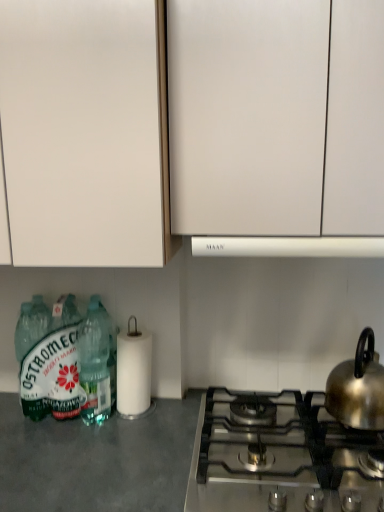
This screenshot has width=384, height=512. Identify the location of translucent plastic bottles at lower left, arranged as the 1th bottle when viewed from the right. (95, 364).

What do you see at coordinates (95, 364) in the screenshot? This screenshot has width=384, height=512. I see `translucent plastic bottles at lower left, arranged as the 1th bottle when viewed from the right` at bounding box center [95, 364].

Where is `green matte bottle at lower left, the first bottle viewed from the left`? This screenshot has height=512, width=384. green matte bottle at lower left, the first bottle viewed from the left is located at coordinates [x=49, y=358].

The image size is (384, 512). What do you see at coordinates (133, 371) in the screenshot?
I see `white matte paper towel at lower center` at bounding box center [133, 371].

This screenshot has height=512, width=384. Identify the location of white matte vent at center. (287, 247).

In order to face white matte vent at center, should I rotate leftwards or rightwards?

You should look right and rotate roughly 13.896 degrees.

Describe the element at coordinates (358, 388) in the screenshot. Image resolution: width=384 pixels, height=512 pixels. I see `shiny metallic kettle at right` at that location.

Locate an element on the screen. The height and width of the screenshot is (512, 384). white matte cabinet at upper center, the 2th cabinetry in the left-to-right sequence is located at coordinates (188, 124).

Between white matte cabinet at upper left, the second cabinetry from the right, and translucent plastic bottles at lower left, placed as the second bottle when sorted from left to right, which one has larger size?

white matte cabinet at upper left, the second cabinetry from the right, is bigger.

Considering the positions of objects white matte cabinet at upper left, the second cabinetry from the right, and translucent plastic bottles at lower left, arranged as the 1th bottle when viewed from the right, in the image provided, who is in front, white matte cabinet at upper left, the second cabinetry from the right, or translucent plastic bottles at lower left, arranged as the 1th bottle when viewed from the right,?

white matte cabinet at upper left, the second cabinetry from the right, is in front.

From the image's perspective, is white matte cabinet at upper left, placed as the 1th cabinetry when sorted from left to right, under translucent plastic bottles at lower left, placed as the second bottle when sorted from left to right?

Actually, white matte cabinet at upper left, placed as the 1th cabinetry when sorted from left to right, appears above translucent plastic bottles at lower left, placed as the second bottle when sorted from left to right, in the image.

Considering the sizes of objects white matte cabinet at upper left, placed as the 1th cabinetry when sorted from left to right, and translucent plastic bottles at lower left, arranged as the 1th bottle when viewed from the right, in the image provided, who is wider, white matte cabinet at upper left, placed as the 1th cabinetry when sorted from left to right, or translucent plastic bottles at lower left, arranged as the 1th bottle when viewed from the right,?

white matte cabinet at upper left, placed as the 1th cabinetry when sorted from left to right.

Who is smaller, white matte cabinet at upper center, the 2th cabinetry in the left-to-right sequence, or gray matte countertop at lower left?

With smaller size is white matte cabinet at upper center, the 2th cabinetry in the left-to-right sequence.

How different are the orientations of white matte cabinet at upper center, which ranks as the 1th cabinetry in right-to-left order, and gray matte countertop at lower left in degrees?

0.584 degrees.

There is a gray matte countertop at lower left. Where is `the 2nd cabinetry above it (from a real-world perspective)`? Image resolution: width=384 pixels, height=512 pixels. the 2nd cabinetry above it (from a real-world perspective) is located at coordinates (188, 124).

Does white matte cabinet at upper center, the 2th cabinetry in the left-to-right sequence, contain gray matte countertop at lower left?

No, gray matte countertop at lower left is located outside of white matte cabinet at upper center, the 2th cabinetry in the left-to-right sequence.

The image size is (384, 512). I want to click on the 1st bottle behind the gray matte countertop at lower left, so point(95,364).

Would you say gray matte countertop at lower left is inside or outside translucent plastic bottles at lower left, placed as the second bottle when sorted from left to right?

gray matte countertop at lower left is located beyond the bounds of translucent plastic bottles at lower left, placed as the second bottle when sorted from left to right.

Consider the image. How different are the orientations of gray matte countertop at lower left and translucent plastic bottles at lower left, arranged as the 1th bottle when viewed from the right, in degrees?

0.979 degrees.

Considering the sizes of gray matte countertop at lower left and translucent plastic bottles at lower left, placed as the second bottle when sorted from left to right, in the image, is gray matte countertop at lower left bigger or smaller than translucent plastic bottles at lower left, placed as the second bottle when sorted from left to right,?

Considering their sizes, gray matte countertop at lower left takes up more space than translucent plastic bottles at lower left, placed as the second bottle when sorted from left to right.

From a real-world perspective, which is physically above, translucent plastic bottles at lower left, arranged as the 1th bottle when viewed from the right, or white matte vent at center?

white matte vent at center.

Considering the sizes of objects translucent plastic bottles at lower left, placed as the second bottle when sorted from left to right, and white matte vent at center in the image provided, who is smaller, translucent plastic bottles at lower left, placed as the second bottle when sorted from left to right, or white matte vent at center?

translucent plastic bottles at lower left, placed as the second bottle when sorted from left to right, is smaller.

Which point is more distant from viewer, [88,367] or [253,244]?

The point [88,367] is farther.

Which is correct: satin silver gas stove at lower right is inside white matte cabinet at upper center, the 2th cabinetry in the left-to-right sequence, or outside of it?

satin silver gas stove at lower right lies outside white matte cabinet at upper center, the 2th cabinetry in the left-to-right sequence.

Is satin silver gas stove at lower right aimed at white matte cabinet at upper center, which ranks as the 1th cabinetry in right-to-left order?

No, satin silver gas stove at lower right is not oriented towards white matte cabinet at upper center, which ranks as the 1th cabinetry in right-to-left order.

From the image's perspective, which is above, shiny metallic kettle at right or gray matte countertop at lower left?

shiny metallic kettle at right.

Is shiny metallic kettle at right looking in the opposite direction of gray matte countertop at lower left?

No, shiny metallic kettle at right is not facing away from gray matte countertop at lower left.

Is shiny metallic kettle at right placed right next to gray matte countertop at lower left?

They are not placed beside each other.

Is shiny metallic kettle at right behind gray matte countertop at lower left?

Yes, shiny metallic kettle at right is further from the viewer.

Considering the relative sizes of white matte cabinet at upper center, the 2th cabinetry in the left-to-right sequence, and shiny metallic kettle at right in the image provided, is white matte cabinet at upper center, the 2th cabinetry in the left-to-right sequence, bigger than shiny metallic kettle at right?

Indeed, white matte cabinet at upper center, the 2th cabinetry in the left-to-right sequence, has a larger size compared to shiny metallic kettle at right.

In the scene shown: From a real-world perspective, is white matte cabinet at upper center, which ranks as the 1th cabinetry in right-to-left order, over shiny metallic kettle at right?

Correct, in the physical world, white matte cabinet at upper center, which ranks as the 1th cabinetry in right-to-left order, is higher than shiny metallic kettle at right.

Could you measure the distance between white matte cabinet at upper center, the 2th cabinetry in the left-to-right sequence, and shiny metallic kettle at right?

white matte cabinet at upper center, the 2th cabinetry in the left-to-right sequence, and shiny metallic kettle at right are 25.70 inches apart from each other.

I want to click on bottle that is the 2nd one below the white matte cabinet at upper left, the second cabinetry from the right (from a real-world perspective), so click(x=95, y=364).

The height and width of the screenshot is (512, 384). Identify the location of counter top that appears below the white matte cabinet at upper center, the 2th cabinetry in the left-to-right sequence (from the image's perspective). (97, 460).

Based on their spatial positions, is white matte vent at center or white matte cabinet at upper center, which ranks as the 1th cabinetry in right-to-left order, closer to white matte paper towel at lower center?

white matte vent at center lies closer to white matte paper towel at lower center than the other object.

Estimate the real-world distances between objects in this image. Which object is closer to gray matte countertop at lower left, white matte paper towel at lower center or green matte bottle at lower left, which is the 2th bottle from right to left?

The object closer to gray matte countertop at lower left is green matte bottle at lower left, which is the 2th bottle from right to left.

Considering their positions, is satin silver gas stove at lower right positioned closer to white matte cabinet at upper center, which ranks as the 1th cabinetry in right-to-left order, than white matte paper towel at lower center?

white matte paper towel at lower center is closer to white matte cabinet at upper center, which ranks as the 1th cabinetry in right-to-left order.

Based on their spatial positions, is translucent plastic bottles at lower left, arranged as the 1th bottle when viewed from the right, or shiny metallic kettle at right further from green matte bottle at lower left, which is the 2th bottle from right to left?

Based on the image, shiny metallic kettle at right appears to be further to green matte bottle at lower left, which is the 2th bottle from right to left.

When comparing their distances from white matte vent at center, does white matte cabinet at upper left, the second cabinetry from the right, or gray matte countertop at lower left seem further?

gray matte countertop at lower left.

Looking at the image, which one is located further to white matte cabinet at upper left, placed as the 1th cabinetry when sorted from left to right, white matte cabinet at upper center, which ranks as the 1th cabinetry in right-to-left order, or white matte vent at center?

white matte vent at center.

Estimate the real-world distances between objects in this image. Which object is closer to white matte cabinet at upper center, which ranks as the 1th cabinetry in right-to-left order, white matte vent at center or green matte bottle at lower left, which is the 2th bottle from right to left?

white matte vent at center lies closer to white matte cabinet at upper center, which ranks as the 1th cabinetry in right-to-left order, than the other object.

Considering their positions, is gray matte countertop at lower left positioned further to satin silver gas stove at lower right than green matte bottle at lower left, which is the 2th bottle from right to left?

Based on the image, green matte bottle at lower left, which is the 2th bottle from right to left, appears to be further to satin silver gas stove at lower right.

The image size is (384, 512). In order to click on paper towel between green matte bottle at lower left, the first bottle viewed from the left, and shiny metallic kettle at right, in the horizontal direction in this screenshot , I will do `click(133, 371)`.

At what (x,y) coordinates should I click in order to perform the action: click on paper towel between white matte vent at center and gray matte countertop at lower left in the vertical direction. Please return your answer as a coordinate pair (x, y). The height and width of the screenshot is (512, 384). Looking at the image, I should click on (133, 371).

Identify the location of counter top located between green matte bottle at lower left, which is the 2th bottle from right to left, and satin silver gas stove at lower right in the left-right direction. The height and width of the screenshot is (512, 384). (97, 460).

Locate an element on the screen. gas stove between translucent plastic bottles at lower left, placed as the second bottle when sorted from left to right, and shiny metallic kettle at right is located at coordinates (280, 456).